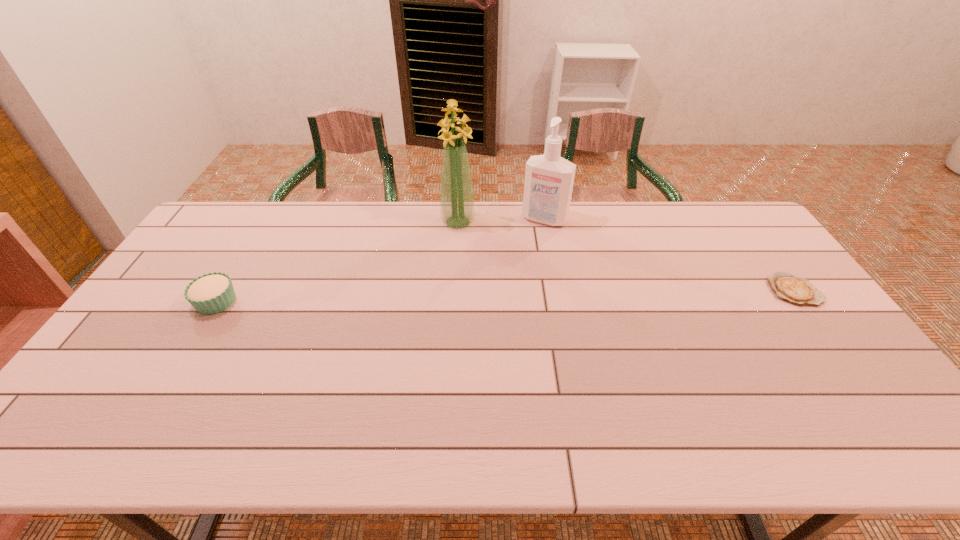
Identify the location of vacant space located 0.310m on the front label of the second object from right to left. (506, 284).

Where is `vacant area situated 0.070m on the front label of the second object from right to left`? This screenshot has width=960, height=540. vacant area situated 0.070m on the front label of the second object from right to left is located at coordinates (531, 239).

You are a GUI agent. You are given a task and a screenshot of the screen. Output one action in this format:
    pyautogui.click(x=<x>, y=<y>)
    Task: Click on the free location located on the front-facing side of the bouquet
    The image size is (960, 540).
    Given the screenshot: What is the action you would take?
    pyautogui.click(x=467, y=299)

At what (x,y) coordinates should I click in order to perform the action: click on vacant space located on the front-facing side of the bouquet. Please return your answer as a coordinate pair (x, y). This screenshot has width=960, height=540. Looking at the image, I should click on (465, 285).

The image size is (960, 540). Find the location of `free space located on the front-facing side of the bouquet`. free space located on the front-facing side of the bouquet is located at coordinates (462, 252).

This screenshot has width=960, height=540. Find the location of `cleansing agent that is at the far edge`. cleansing agent that is at the far edge is located at coordinates (549, 178).

The image size is (960, 540). What are the coordinates of `bouquet situated at the far edge` in the screenshot? It's located at (457, 203).

I want to click on object that is at the left edge, so click(211, 293).

What are the coordinates of `object that is at the right edge` in the screenshot? It's located at (800, 291).

What are the coordinates of `vacant space at the far edge` in the screenshot? It's located at (294, 226).